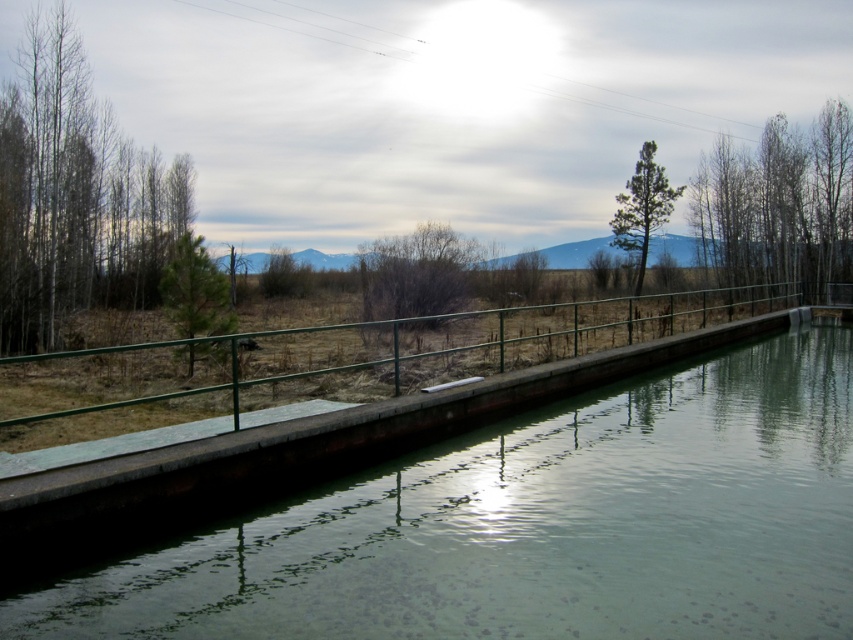
From the picture: You are a maintenance worker checking the canal. You need to determine which object between the green concrete river at center and the green metal rail at center requires more attention based on their sizes. Which one is smaller?

The green concrete river at center is smaller than the green metal rail at center, so it requires more attention.

Looking at this image, you are standing at the edge of the canal and want to place a small decorative statue on the green concrete river at center so it can be seen from the green metal rail at center. Will the statue be visible from there?

The green concrete river at center has a lesser height compared to the green metal rail at center. Since the statue is placed on the lower surface, it will be visible from the higher green metal rail at center.